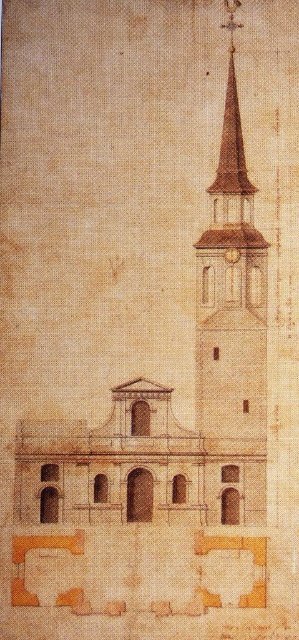
Is brown brick bell tower at upper right to the left of gold textured clock at center from the viewer's perspective?

No, brown brick bell tower at upper right is not to the left of gold textured clock at center.

Who is positioned more to the left, brown brick bell tower at upper right or gold textured clock at center?

Positioned to the left is gold textured clock at center.

Where is `brown brick bell tower at upper right`? brown brick bell tower at upper right is located at coordinates (232, 291).

The width and height of the screenshot is (299, 640). I want to click on brown brick bell tower at upper right, so click(232, 291).